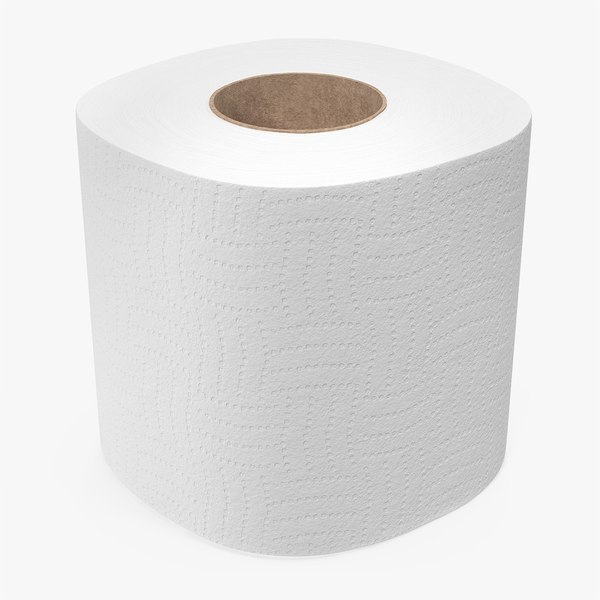
Identify the location of left top of toilet paper roll. The height and width of the screenshot is (600, 600). (146, 109).